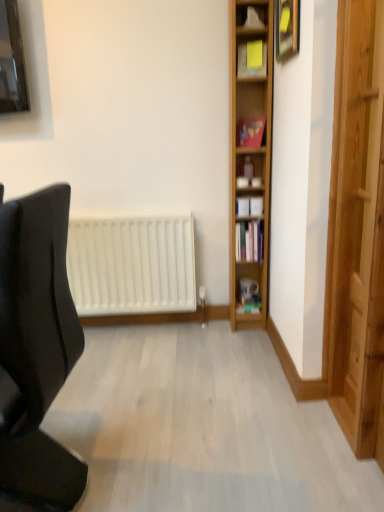
Question: Is black matte chair at left oriented towards hardcover book at center-right, arranged as the 2th book when viewed from the back?

Choices:
 (A) yes
 (B) no

Answer: (B)

Question: From the image's perspective, is black matte chair at left on top of hardcover book at center-right, which is counted as the second book, starting from the top?

Choices:
 (A) no
 (B) yes

Answer: (A)

Question: Considering the relative sizes of black matte chair at left and hardcover book at center-right, the 2th book in the front-to-back sequence, in the image provided, is black matte chair at left shorter than hardcover book at center-right, the 2th book in the front-to-back sequence,?

Choices:
 (A) no
 (B) yes

Answer: (A)

Question: Is black matte chair at left smaller than hardcover book at center-right, which is counted as the second book, starting from the top?

Choices:
 (A) yes
 (B) no

Answer: (B)

Question: Is black matte chair at left at the left side of hardcover book at center-right, the 2th book in the front-to-back sequence?

Choices:
 (A) no
 (B) yes

Answer: (B)

Question: Visually, is matte gold picture frame at upper right positioned to the left or to the right of hardcover book at center-right, the 2th book in the front-to-back sequence?

Choices:
 (A) right
 (B) left

Answer: (A)

Question: Considering the positions of point (281, 48) and point (241, 241), is point (281, 48) closer or farther from the camera than point (241, 241)?

Choices:
 (A) farther
 (B) closer

Answer: (B)

Question: Considering their positions, is matte gold picture frame at upper right located in front of or behind hardcover book at center-right, the 2th book in the front-to-back sequence?

Choices:
 (A) front
 (B) behind

Answer: (A)

Question: From a real-world perspective, is matte gold picture frame at upper right physically located above or below hardcover book at center-right, the 2th book in the front-to-back sequence?

Choices:
 (A) above
 (B) below

Answer: (A)

Question: Relative to yellow paper at upper center, the first shelf viewed from the top, is hardcover book at center-right, which is counted as the second book, starting from the top, in front or behind?

Choices:
 (A) front
 (B) behind

Answer: (B)

Question: Visually, is hardcover book at center-right, arranged as the 2th book when viewed from the back, positioned to the left or to the right of yellow paper at upper center, the first shelf viewed from the top?

Choices:
 (A) left
 (B) right

Answer: (B)

Question: Looking at the image, does hardcover book at center-right, arranged as the 2th book when viewed from the back, seem bigger or smaller compared to yellow paper at upper center, acting as the 2th shelf starting from the bottom?

Choices:
 (A) small
 (B) big

Answer: (A)

Question: Is hardcover book at center-right, which appears as the 2th book when ordered from the bottom, wider or thinner than yellow paper at upper center, acting as the 2th shelf starting from the bottom?

Choices:
 (A) wide
 (B) thin

Answer: (B)

Question: From a real-world perspective, relative to matte gold picture frame at upper right, is light brown wooden shelf at right, marked as the 1th shelf in a bottom-to-top arrangement, vertically above or below?

Choices:
 (A) above
 (B) below

Answer: (B)

Question: Looking at the image, does light brown wooden shelf at right, positioned as the 2th shelf in top-to-bottom order, seem bigger or smaller compared to matte gold picture frame at upper right?

Choices:
 (A) small
 (B) big

Answer: (B)